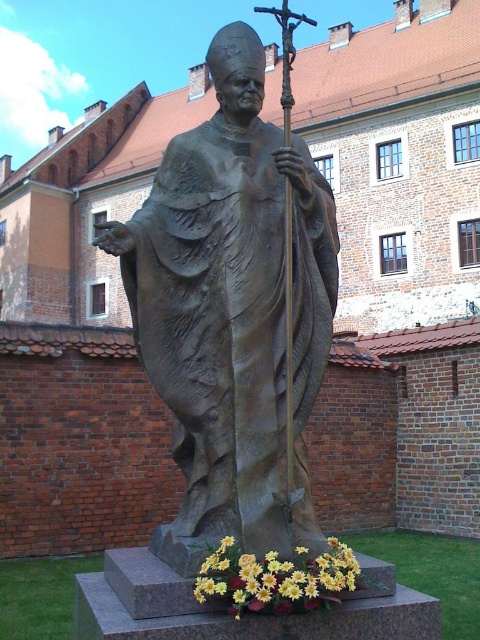
Measure the distance between bronze statue at center and camera.

bronze statue at center and camera are 7.03 meters apart.

Which is above, bronze statue at center or yellow matte flowers at lower center?

bronze statue at center is above.

Between point (268, 502) and point (355, 588), which one is positioned behind?

The point (268, 502) is more distant.

Locate an element on the screen. The height and width of the screenshot is (640, 480). bronze statue at center is located at coordinates (231, 312).